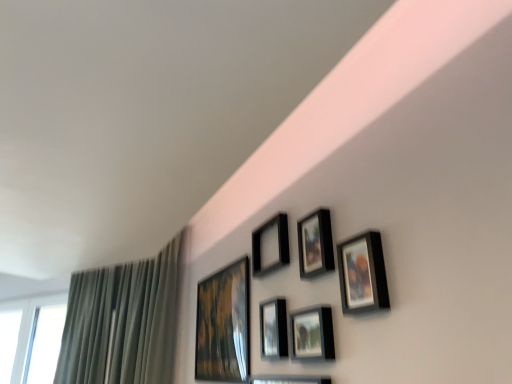
Question: From the image's perspective, is matte black picture frame at upper center, the 5th picture frame positioned from the left, located above or below matte black picture frame at center, the 3th picture frame viewed from the left?

Choices:
 (A) above
 (B) below

Answer: (A)

Question: Looking at their shapes, would you say matte black picture frame at upper center, arranged as the 2th picture frame when viewed from the right, is wider or thinner than matte black picture frame at center, the fourth picture frame from the right?

Choices:
 (A) wide
 (B) thin

Answer: (B)

Question: Which is nearer to the matte black picture frame at upper center, the 5th picture frame positioned from the left?

Choices:
 (A) matte gold painting at upper center, which is the sixth picture frame from right to left
 (B) white glass window at lower left
 (C) matte black picture frame at upper right, arranged as the 6th picture frame when viewed from the left
 (D) matte black picture frame at lower center, which is counted as the 4th picture frame, starting from the left
 (E) matte black picture frame at center, the 3th picture frame viewed from the left

Answer: (C)

Question: Based on their relative distances, which object is nearer to the matte black picture frame at upper right, arranged as the 1th picture frame when viewed from the right?

Choices:
 (A) matte gold painting at upper center, which is the sixth picture frame from right to left
 (B) matte black picture frame at upper center, which ranks as the fifth picture frame in right-to-left order
 (C) matte black picture frame at center, the fourth picture frame from the right
 (D) green fabric curtain at left
 (E) matte black picture frame at upper center, arranged as the 2th picture frame when viewed from the right

Answer: (E)